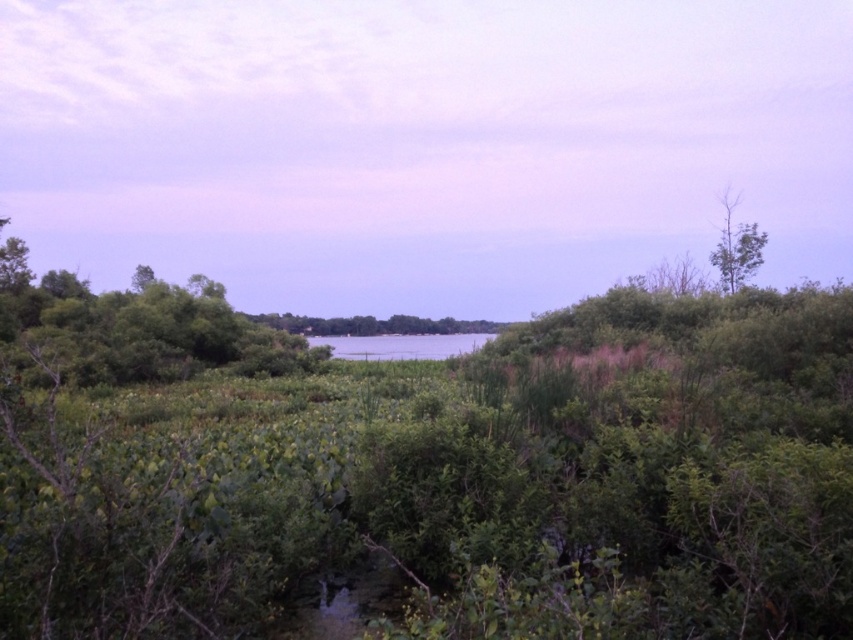
From the picture: You are a hiker who wants to take a photo of both the green leafy tree at left and the green leafy tree at center in the serene landscape. Which tree should you stand closer to in order to capture both in a single frame without zooming?

You should stand closer to the green leafy tree at center because it is smaller in size compared to the green leafy tree at left, allowing both to fit within the camera frame more easily when positioned nearer to the smaller tree.

You are a hiker who wants to cross the body of water using a 150 feet long rope bridge. The bridge can only be anchored between two trees. Given that the green leafy tree at left and the green leafy tree at center are available, will the bridge fit between them?

The green leafy tree at left and green leafy tree at center are 153.76 feet apart from each other. Since the bridge is 150 feet long, it will fit between them as the distance between the trees is slightly longer than the bridge.